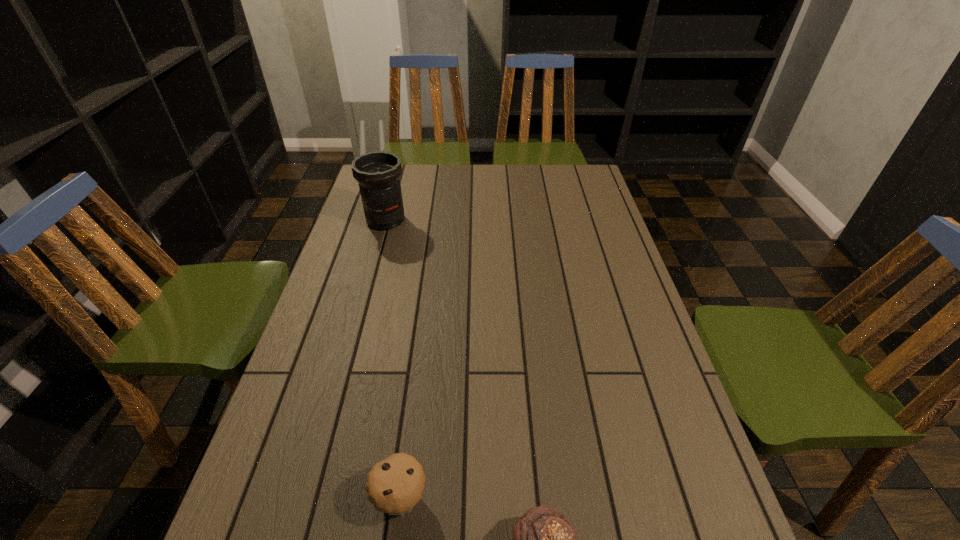
The width and height of the screenshot is (960, 540). What are the coordinates of `the farthest object` in the screenshot? It's located at (378, 174).

Where is `telephoto lens`? This screenshot has width=960, height=540. telephoto lens is located at coordinates (378, 174).

Locate an element on the screen. the second object from left to right is located at coordinates (395, 485).

You are a GUI agent. You are given a task and a screenshot of the screen. Output one action in this format:
    pyautogui.click(x=<x>, y=<y>)
    Task: Click on the free space located on the right of the farthest object
    The height and width of the screenshot is (540, 960).
    Given the screenshot: What is the action you would take?
    pyautogui.click(x=459, y=220)

What are the coordinates of `free point located on the right of the left muffin` in the screenshot? It's located at (546, 498).

This screenshot has height=540, width=960. Identify the location of object that is at the left edge. (378, 174).

The height and width of the screenshot is (540, 960). What are the coordinates of `vacant region at the far edge of the desktop` in the screenshot? It's located at point(466,187).

The height and width of the screenshot is (540, 960). I want to click on vacant space at the left edge of the desktop, so click(x=370, y=245).

In the image, there is a desktop. Identify the location of vacant space at the right edge. (635, 362).

Where is `free point at the far left corner`? This screenshot has width=960, height=540. free point at the far left corner is located at coordinates (400, 184).